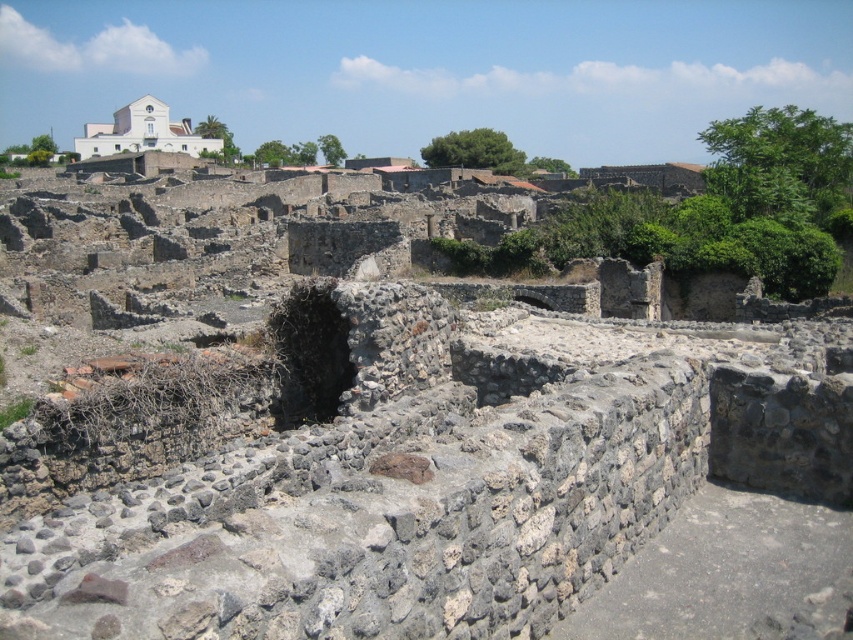
Question: Is dark stone hole at center below white stone building at upper left?

Choices:
 (A) yes
 (B) no

Answer: (A)

Question: Where is dark stone hole at center located in relation to white stone building at upper left in the image?

Choices:
 (A) above
 (B) below

Answer: (B)

Question: Which point is farther to the camera?

Choices:
 (A) dark stone hole at center
 (B) white stone building at upper left

Answer: (B)

Question: Is dark stone hole at center below white stone building at upper left?

Choices:
 (A) no
 (B) yes

Answer: (B)

Question: Which object is closer to the camera taking this photo?

Choices:
 (A) white stone building at upper left
 (B) dark stone hole at center

Answer: (B)

Question: Which of the following is the farthest from the observer?

Choices:
 (A) (299, 323)
 (B) (175, 134)

Answer: (B)